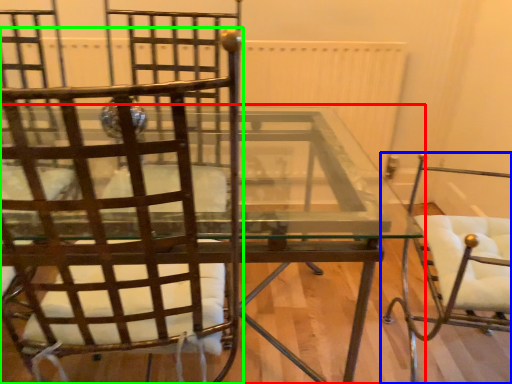
Question: Which is farther away from table (highlighted by a red box)? chair (highlighted by a blue box) or chair (highlighted by a green box)?

Choices:
 (A) chair
 (B) chair

Answer: (A)